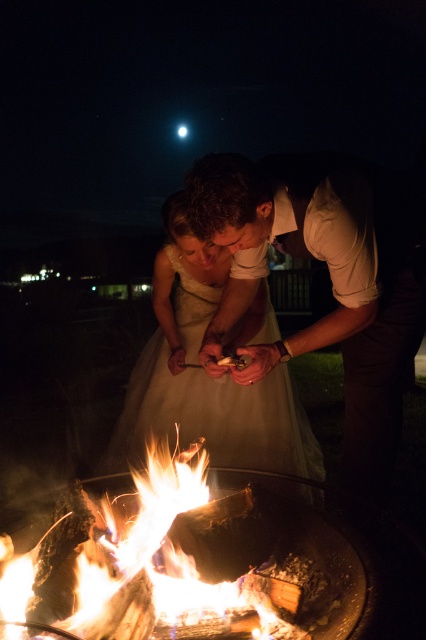
You are a photographer standing at a distance of 10 feet from the white satin dress at center and the flaming wood at center. You want to capture a photo where both the dress and the wood are in focus. Given that your camera has a depth of field that can sharply focus on objects within a 36 inch range, will both subjects be in focus?

The white satin dress at center and flaming wood at center are 36.84 inches apart. Since the camera can focus within a 36 inch range, the distance between them exceeds the depth of field. Therefore, both subjects may not be in focus simultaneously.

You are a photographer standing at the edge of the campfire scene. You want to take a photo that includes both the smooth beige shirt at center and the white satin dress at center. Which object should you focus on first to ensure both are in sharp focus?

You should focus on the smooth beige shirt at center first because it is closer to the viewer than the white satin dress at center. By focusing on the closer object, the depth of field may help keep both in focus.

You are a photographer taking a portrait of the smooth beige shirt at center and the white satin dress at center. Which clothing item has a narrower width?

The smooth beige shirt at center has a narrower width than the white satin dress at center according to the description.